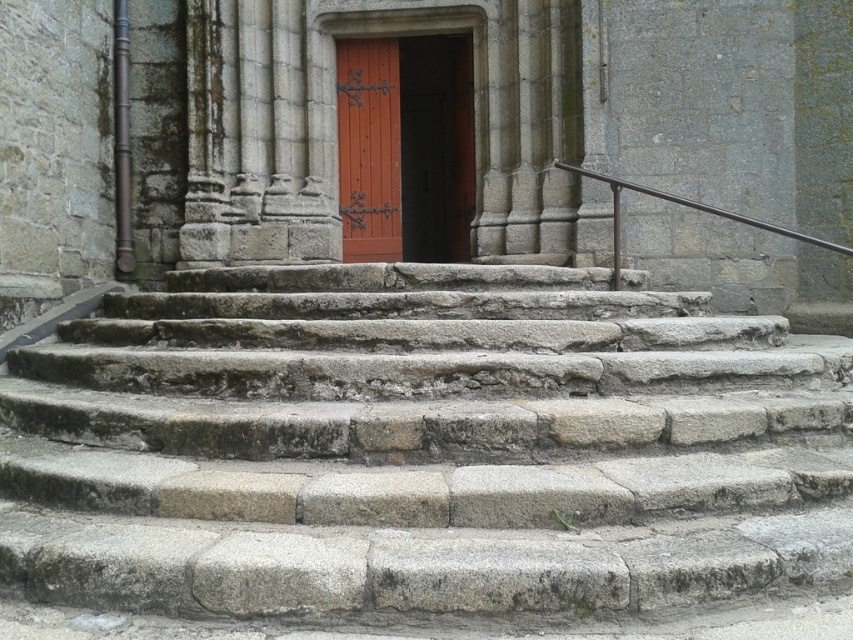
Looking at this image, you are standing at the base of the gray stone stairs at center and want to reach the black metal railing at upper right. Which direction should you move to get closer to the railing?

You should move upward along the gray stone stairs at center because the black metal railing at upper right is located above them, and the stairs are closer to you than the railing.

You are standing at the bottom of the stone steps and want to enter the building. The entrance has a matte orange door at center and a black metal railing at upper right. Which object is closer to your right side when facing the entrance?

The black metal railing at upper right is closer to your right side when facing the entrance because the matte orange door at center is to the left of it.